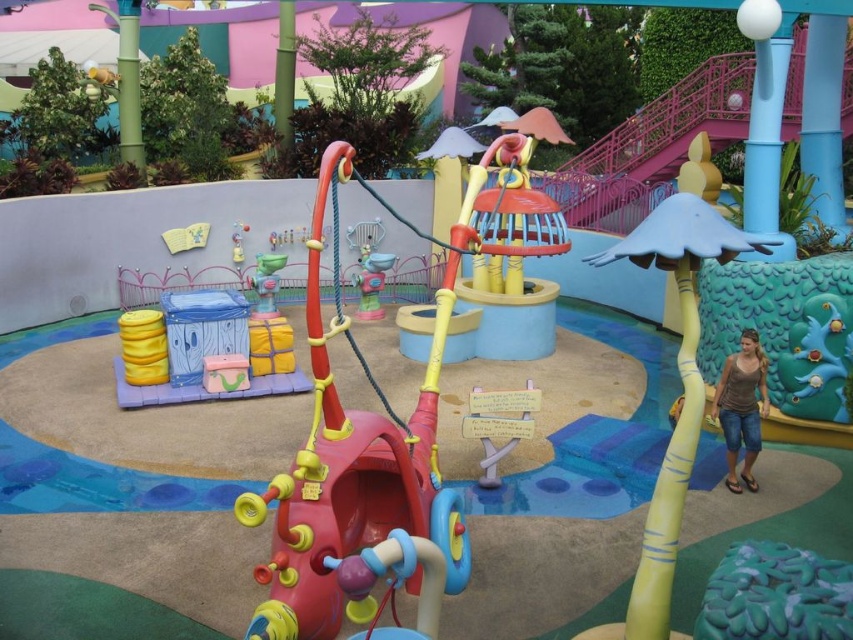
You are standing at the entrance of the playground and see the pastel wood toy at center. If you want to reach it quickly, would you need to walk towards or away from the playground structures?

The pastel wood toy at center is 7.22 meters away from the viewer. Since it is located at the center, you would need to walk towards the playground structures to reach it.

You are a parent supervising children in the playground. You see a child holding the matte plastic toy at center and another child nearby looking at the denim shorts at lower right. Which object is bigger?

The denim shorts at lower right is larger in size than the matte plastic toy at center.